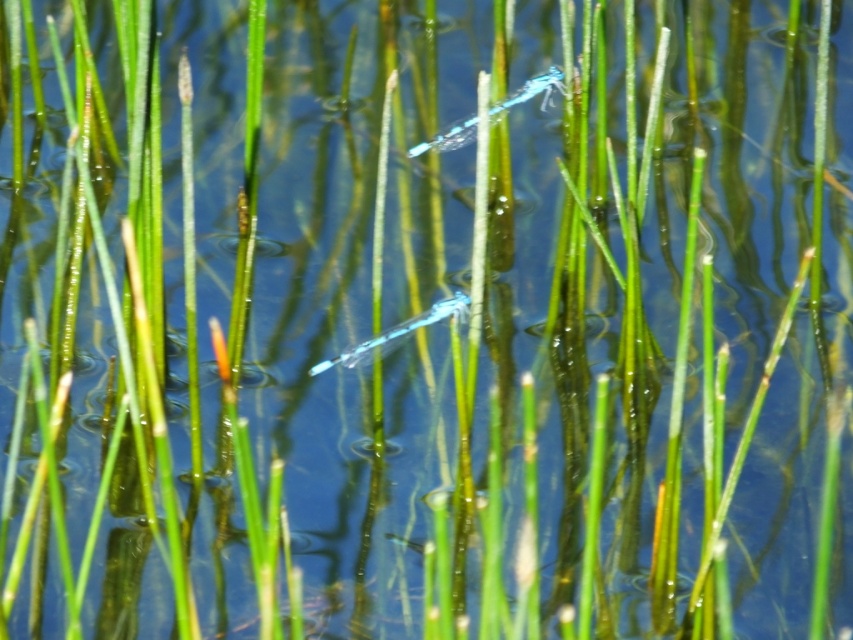
Question: Can you confirm if transparent blue dragonfly at upper center is positioned below translucent blue dragonfly at center?

Choices:
 (A) no
 (B) yes

Answer: (A)

Question: Is transparent blue dragonfly at upper center further to the viewer compared to translucent blue dragonfly at center?

Choices:
 (A) no
 (B) yes

Answer: (B)

Question: Which point is farther to the camera?

Choices:
 (A) translucent blue dragonfly at center
 (B) transparent blue dragonfly at upper center

Answer: (B)

Question: Which object appears farthest from the camera in this image?

Choices:
 (A) translucent blue dragonfly at center
 (B) transparent blue dragonfly at upper center

Answer: (B)

Question: Among these points, which one is farthest from the camera?

Choices:
 (A) (457, 301)
 (B) (459, 122)

Answer: (B)

Question: Does transparent blue dragonfly at upper center appear over translucent blue dragonfly at center?

Choices:
 (A) no
 (B) yes

Answer: (B)